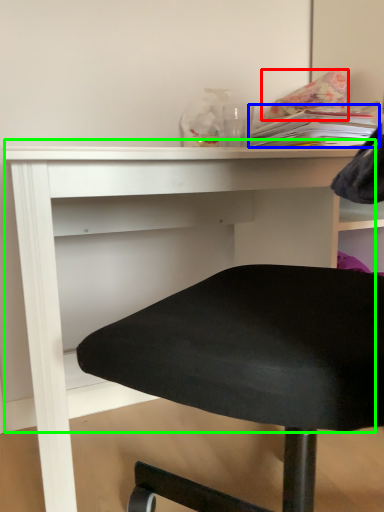
Question: Estimate the real-world distances between objects in this image. Which object is farther from pillow (highlighted by a red box), book (highlighted by a blue box) or table (highlighted by a green box)?

Choices:
 (A) book
 (B) table

Answer: (B)